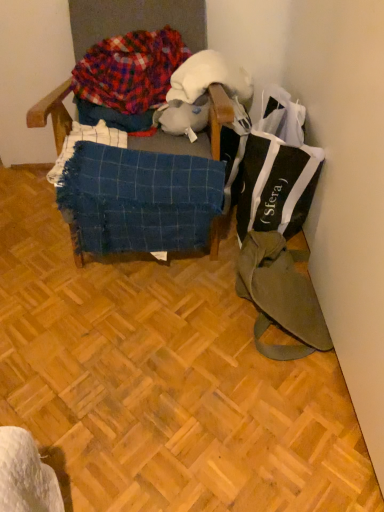
Where is `vacant space to the left of olive green canvas messenger bag at lower right`? This screenshot has width=384, height=512. vacant space to the left of olive green canvas messenger bag at lower right is located at coordinates (186, 330).